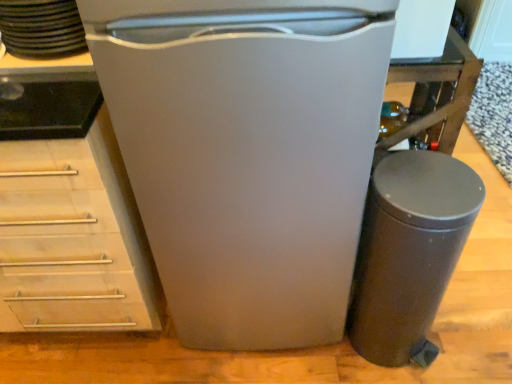
Question: Is white matte refrigerator at center shorter than matte black trash can at lower right?

Choices:
 (A) yes
 (B) no

Answer: (B)

Question: Is white matte refrigerator at center wider than matte black trash can at lower right?

Choices:
 (A) yes
 (B) no

Answer: (A)

Question: Is the depth of white matte refrigerator at center greater than that of matte black trash can at lower right?

Choices:
 (A) yes
 (B) no

Answer: (B)

Question: Does white matte refrigerator at center have a smaller size compared to matte black trash can at lower right?

Choices:
 (A) yes
 (B) no

Answer: (B)

Question: Can you confirm if white matte refrigerator at center is positioned to the left of matte black trash can at lower right?

Choices:
 (A) yes
 (B) no

Answer: (A)

Question: Is white matte refrigerator at center located outside matte black trash can at lower right?

Choices:
 (A) yes
 (B) no

Answer: (A)

Question: Are matte black trash can at lower right and black matte stack of plates at upper left far apart?

Choices:
 (A) yes
 (B) no

Answer: (B)

Question: Could you tell me if matte black trash can at lower right is turned towards black matte stack of plates at upper left?

Choices:
 (A) yes
 (B) no

Answer: (B)

Question: From a real-world perspective, is matte black trash can at lower right under black matte stack of plates at upper left?

Choices:
 (A) no
 (B) yes

Answer: (B)

Question: Is matte black trash can at lower right taller than black matte stack of plates at upper left?

Choices:
 (A) yes
 (B) no

Answer: (A)

Question: Does matte black trash can at lower right have a larger size compared to black matte stack of plates at upper left?

Choices:
 (A) yes
 (B) no

Answer: (A)

Question: Would you say matte black trash can at lower right contains black matte stack of plates at upper left?

Choices:
 (A) yes
 (B) no

Answer: (B)

Question: Is black matte stack of plates at upper left to the left of matte black trash can at lower right from the viewer's perspective?

Choices:
 (A) yes
 (B) no

Answer: (A)